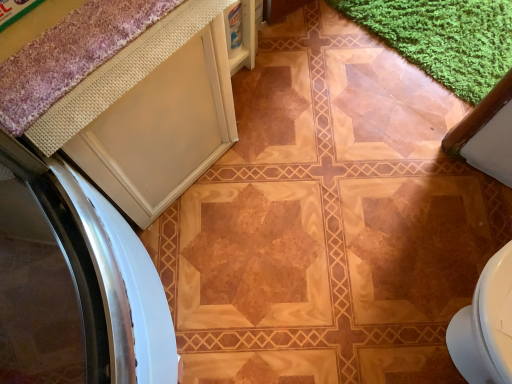
Question: From a real-world perspective, is white matte cabinet at upper left located higher than purple textured bath mat at upper left?

Choices:
 (A) yes
 (B) no

Answer: (B)

Question: Are white matte cabinet at upper left and purple textured bath mat at upper left located far from each other?

Choices:
 (A) no
 (B) yes

Answer: (A)

Question: Is white matte cabinet at upper left turned away from purple textured bath mat at upper left?

Choices:
 (A) no
 (B) yes

Answer: (A)

Question: From a real-world perspective, is white matte cabinet at upper left below purple textured bath mat at upper left?

Choices:
 (A) no
 (B) yes

Answer: (B)

Question: Is white matte cabinet at upper left bigger than purple textured bath mat at upper left?

Choices:
 (A) yes
 (B) no

Answer: (A)

Question: From the image's perspective, would you say white matte cabinet at upper left is shown under purple textured bath mat at upper left?

Choices:
 (A) no
 (B) yes

Answer: (B)

Question: From the image's perspective, is purple textured bath mat at upper left above white matte cabinet at upper left?

Choices:
 (A) no
 (B) yes

Answer: (B)

Question: Considering the relative positions of purple textured bath mat at upper left and white matte cabinet at upper left in the image provided, is purple textured bath mat at upper left in front of white matte cabinet at upper left?

Choices:
 (A) yes
 (B) no

Answer: (A)

Question: Would you say purple textured bath mat at upper left is outside white matte cabinet at upper left?

Choices:
 (A) no
 (B) yes

Answer: (B)

Question: Is purple textured bath mat at upper left touching white matte cabinet at upper left?

Choices:
 (A) yes
 (B) no

Answer: (B)

Question: Considering the relative positions of purple textured bath mat at upper left and white matte cabinet at upper left in the image provided, is purple textured bath mat at upper left to the right of white matte cabinet at upper left from the viewer's perspective?

Choices:
 (A) no
 (B) yes

Answer: (B)

Question: Does purple textured bath mat at upper left have a larger size compared to white matte cabinet at upper left?

Choices:
 (A) yes
 (B) no

Answer: (B)

Question: From a real-world perspective, relative to white matte cabinet at upper left, is purple textured bath mat at upper left vertically above or below?

Choices:
 (A) below
 (B) above

Answer: (B)